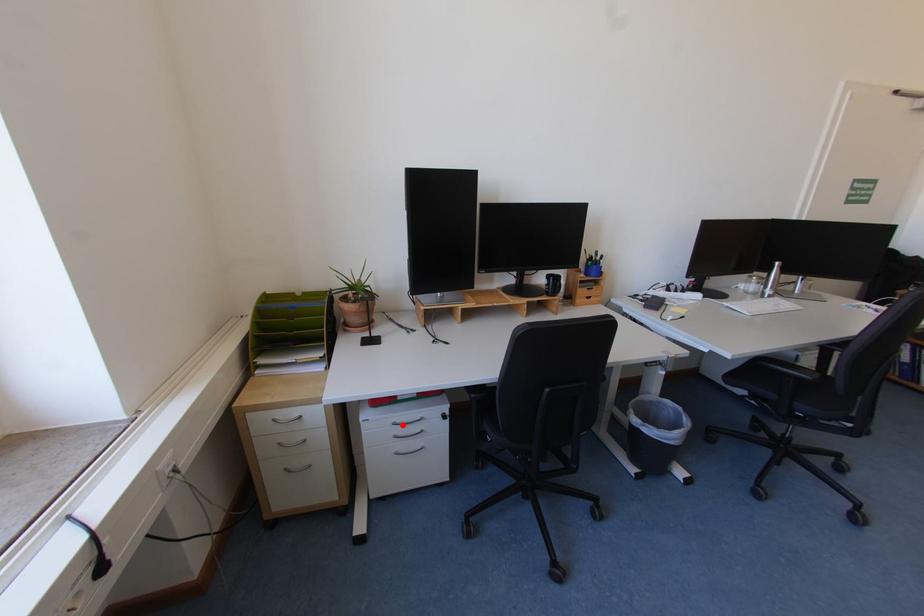
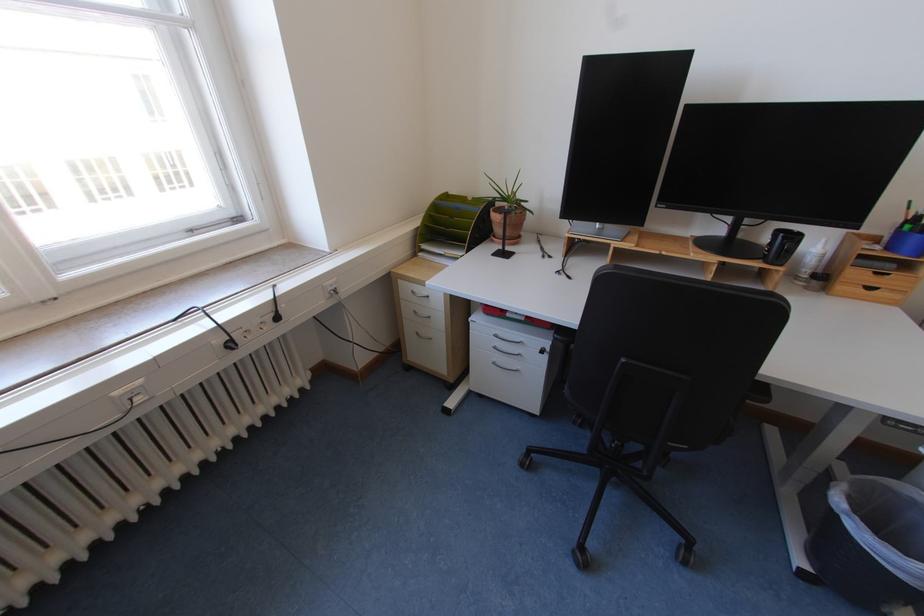
Question: I am providing you with two images of the same scene from different viewpoints. Image1 has a red point marked. In image2, the corresponding 3D location appears at what relative position? Reply with the corresponding letter.

Choices:
 (A) Closer
 (B) Farther

Answer: (A)